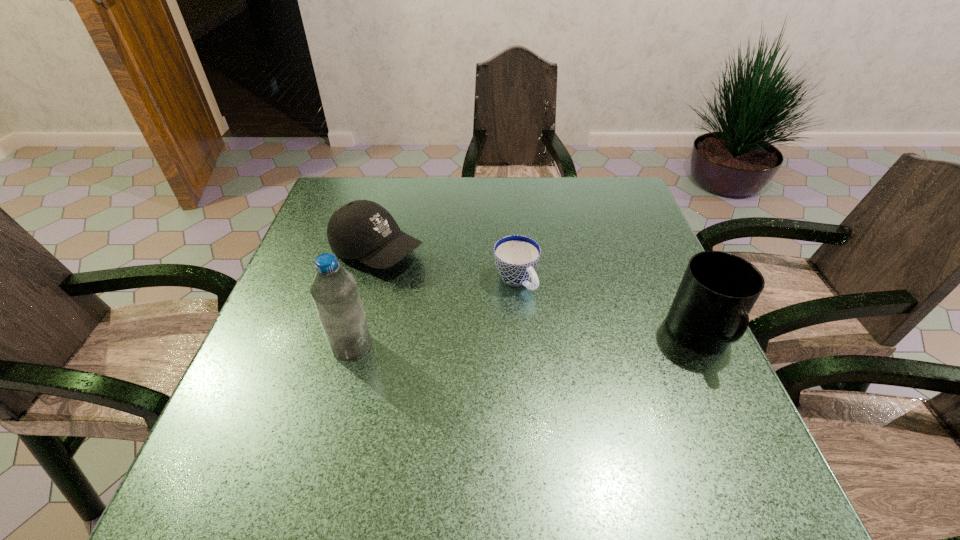
The width and height of the screenshot is (960, 540). Identify the location of the tallest object. (334, 290).

Locate an element on the screen. The width and height of the screenshot is (960, 540). the rightmost object is located at coordinates (710, 310).

Where is `the second tallest object`? Image resolution: width=960 pixels, height=540 pixels. the second tallest object is located at coordinates (710, 310).

At what (x,y) coordinates should I click in order to perform the action: click on the second shortest object. Please return your answer as a coordinate pair (x, y). This screenshot has height=540, width=960. Looking at the image, I should click on (364, 230).

The height and width of the screenshot is (540, 960). In order to click on cup in this screenshot , I will do tap(516, 257).

Where is `the third object from left to right`? the third object from left to right is located at coordinates (516, 257).

Identify the location of free region located 0.300m on the back of the tallest object. (379, 243).

At what (x,y) coordinates should I click in order to perform the action: click on free region located 0.130m on the side of the rightmost object with the handle. Please return your answer as a coordinate pair (x, y). Looking at the image, I should click on (748, 435).

At what (x,y) coordinates should I click in order to perform the action: click on free point located on the front-facing side of the baseball cap. Please return your answer as a coordinate pair (x, y). The height and width of the screenshot is (540, 960). Looking at the image, I should click on (556, 335).

Identify the location of blank space located 0.300m on the front-facing side of the baseball cap. Image resolution: width=960 pixels, height=540 pixels. (519, 318).